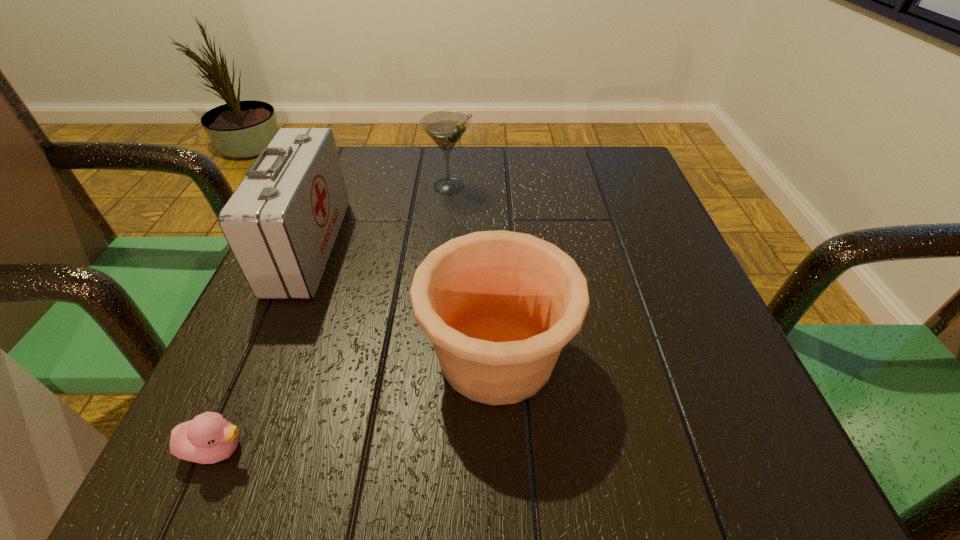
This screenshot has height=540, width=960. I want to click on blank area at the far left corner, so 379,154.

Find the location of a particular element. vacant space at the far right corner of the desktop is located at coordinates (581, 198).

This screenshot has height=540, width=960. I want to click on unoccupied area between the first-aid kit and the shortest object, so click(264, 348).

The image size is (960, 540). Identify the location of vacant area between the martini and the nearest object. (334, 318).

This screenshot has width=960, height=540. I want to click on vacant area that lies between the first-aid kit and the shortest object, so click(264, 348).

At what (x,y) coordinates should I click in order to perform the action: click on vacant region between the pottery and the first-aid kit. Please return your answer as a coordinate pair (x, y). The image size is (960, 540). Looking at the image, I should click on (403, 300).

Where is `free space that is in between the shortest object and the first-aid kit`? The height and width of the screenshot is (540, 960). free space that is in between the shortest object and the first-aid kit is located at coordinates (264, 348).

Identify the location of vacant area that lies between the duckling and the first-aid kit. (264, 348).

Find the location of a particular element. The height and width of the screenshot is (540, 960). blank region between the farthest object and the duckling is located at coordinates (334, 318).

Image resolution: width=960 pixels, height=540 pixels. Identify the location of vacant point located between the nearest object and the first-aid kit. (264, 348).